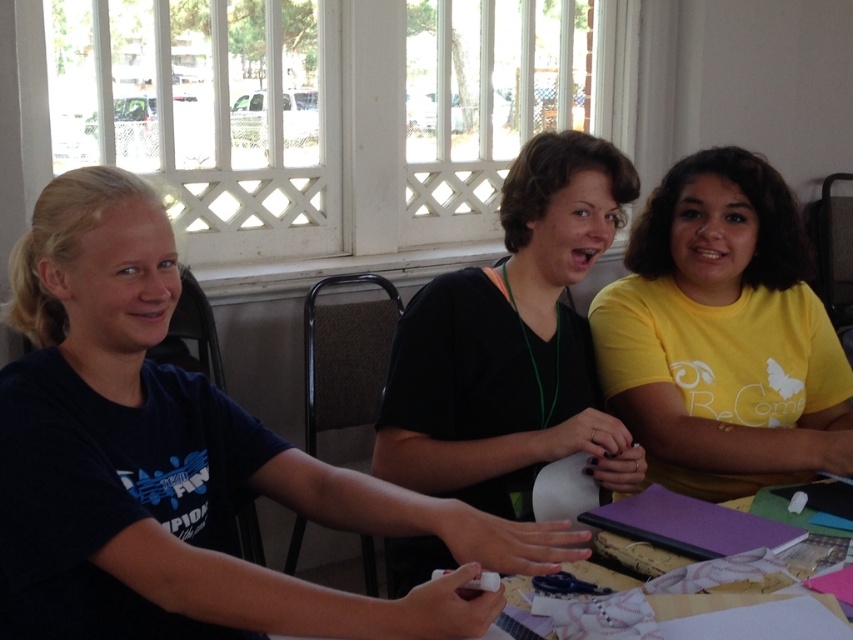
You are standing 2 meters away from the table where the three people are sitting. You want to reach the point at coordinates point (x=761, y=241) on the table. Can you reach it without moving your feet?

The point at coordinates point (x=761, y=241) is 1.78 meters away from you, so yes, you can reach it without moving your feet since it is within your 2 meters distance.

Which object is wider, the yellow matte shirt at center or the wooden table at center?

The yellow matte shirt at center is wider than the wooden table at center according to the description.

You are a tailor measuring the distance between two shirts on a table. The yellow matte shirt at center and the black matte shirt at center are placed on a table. The tailor needs to place a 12.5 inch wide fabric between them. Will there be enough space between the shirts to fit the fabric?

The distance between the yellow matte shirt at center and the black matte shirt at center is 12.90 inches. Since the fabric is 12.5 inches wide, there is enough space to fit it between them as 12.90 is greater than 12.5.